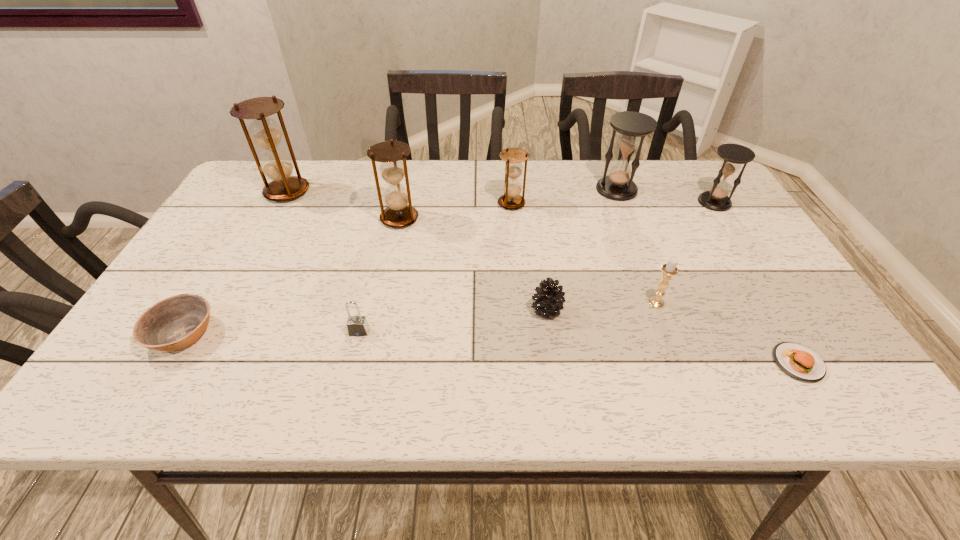
Locate an element on the screen. The height and width of the screenshot is (540, 960). candle holder is located at coordinates (669, 269).

Image resolution: width=960 pixels, height=540 pixels. In order to click on brown pinecone in this screenshot , I will do `click(549, 299)`.

Locate an element on the screen. Image resolution: width=960 pixels, height=540 pixels. padlock is located at coordinates (357, 326).

Where is `bowl`? The height and width of the screenshot is (540, 960). bowl is located at coordinates (174, 323).

Identify the location of food. (798, 361).

Locate an element on the screen. free location located on the right of the leftmost hourglass is located at coordinates (343, 192).

This screenshot has width=960, height=540. Find the location of `vacant region located 0.220m on the right of the left black hourglass`. vacant region located 0.220m on the right of the left black hourglass is located at coordinates (710, 190).

Where is `vacant area situated 0.400m on the right of the second biggest brown hourglass`? This screenshot has height=540, width=960. vacant area situated 0.400m on the right of the second biggest brown hourglass is located at coordinates (563, 218).

Where is `free space located on the front of the right black hourglass`? Image resolution: width=960 pixels, height=540 pixels. free space located on the front of the right black hourglass is located at coordinates (760, 274).

Locate an element on the screen. vacant space located on the right of the rightmost brown hourglass is located at coordinates (577, 203).